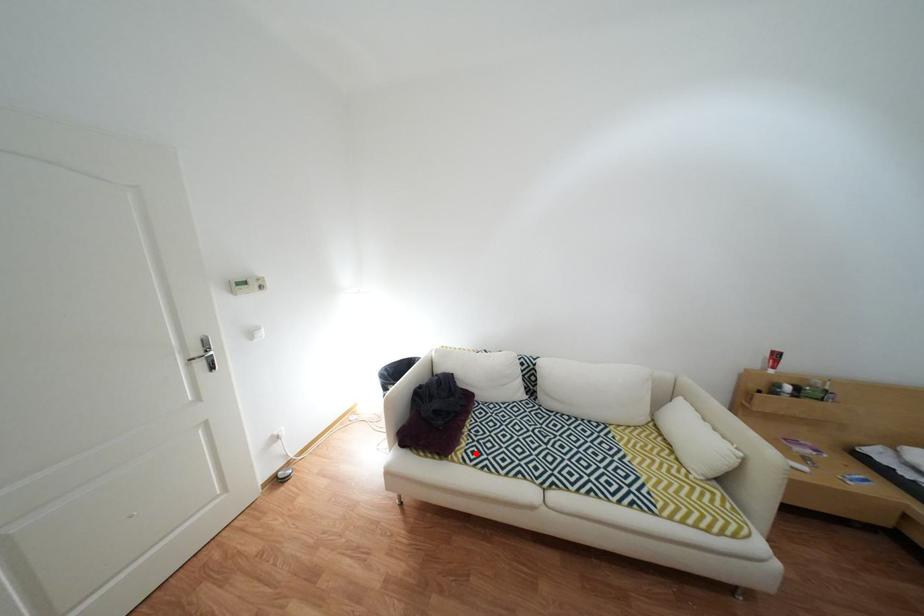
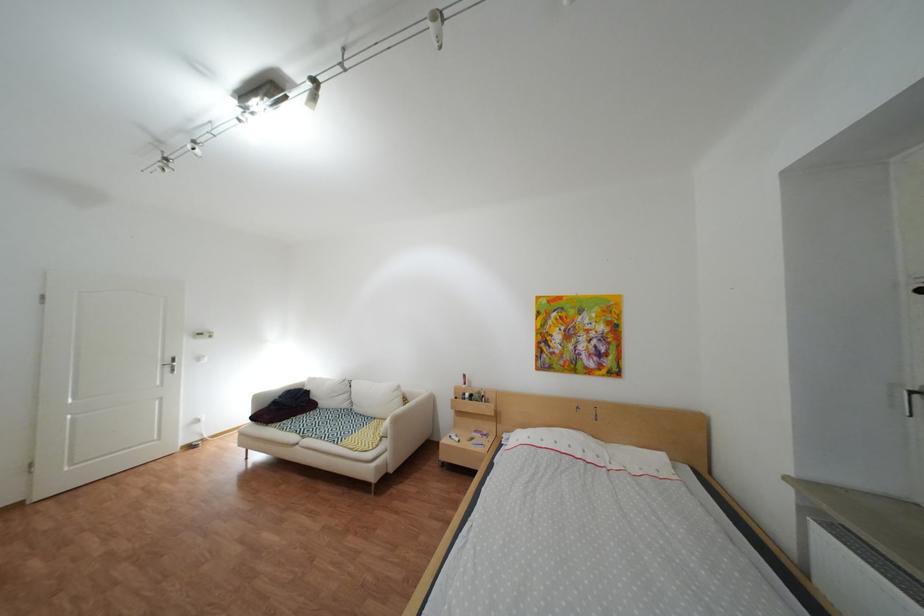
Question: I am providing you with two images of the same scene from different viewpoints. Given a red point in image1, look at the same physical point in image2. Is it:

Choices:
 (A) Closer to the viewpoint
 (B) Farther from the viewpoint

Answer: (B)